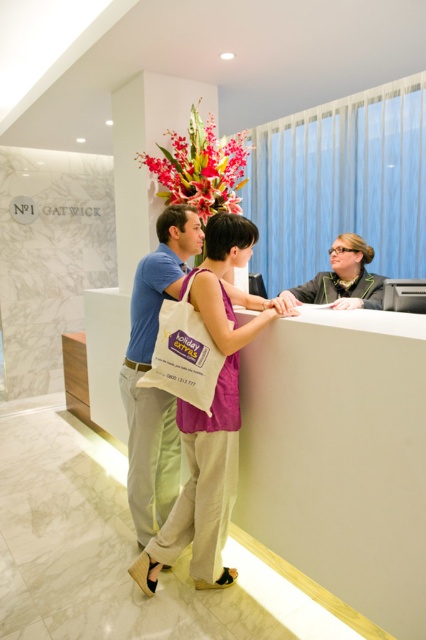
Question: Does light blue cotton shirt at center appear on the right side of vivid floral arrangement at upper center?

Choices:
 (A) yes
 (B) no

Answer: (B)

Question: Which object is closer to the camera taking this photo?

Choices:
 (A) white matte information desk at center
 (B) purple cotton tote bag at center
 (C) vivid floral arrangement at upper center

Answer: (A)

Question: Can you confirm if white matte information desk at center is positioned to the left of white canvas tote at center?

Choices:
 (A) yes
 (B) no

Answer: (B)

Question: In this image, where is purple cotton tote bag at center located relative to light blue cotton shirt at center?

Choices:
 (A) below
 (B) above

Answer: (A)

Question: Which object is positioned farthest from the matte black blazer at center?

Choices:
 (A) white canvas tote at center
 (B) purple cotton tote bag at center
 (C) white matte information desk at center
 (D) vivid floral arrangement at upper center

Answer: (D)

Question: Estimate the real-world distances between objects in this image. Which object is closer to the white matte information desk at center?

Choices:
 (A) vivid floral arrangement at upper center
 (B) light blue cotton shirt at center

Answer: (B)